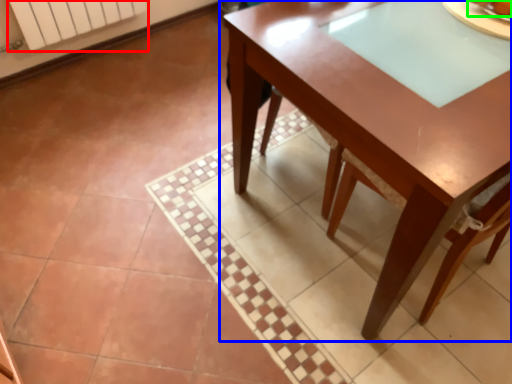
Question: Which object is the farthest from radiator (highlighted by a red box)? Choose among these: table (highlighted by a blue box) or food (highlighted by a green box).

Choices:
 (A) table
 (B) food

Answer: (B)